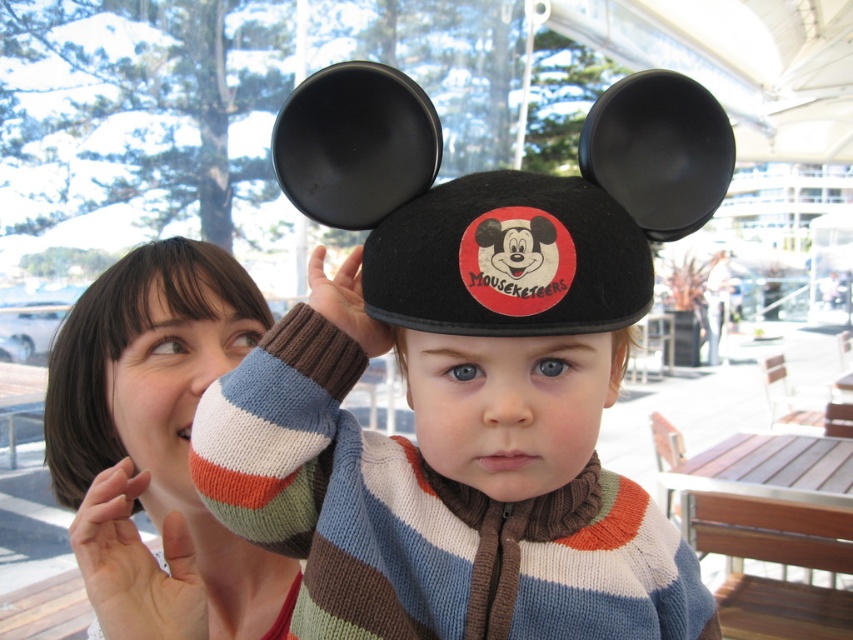
Between black felt hat at center and knit sweater at center, which one appears on the left side from the viewer's perspective?

Positioned to the left is knit sweater at center.

Is black felt hat at center in front of knit sweater at center?

That is True.

The image size is (853, 640). I want to click on black felt hat at center, so click(503, 200).

Measure the distance between fuzzy woolen hat at center and knit sweater at center.

9.29 inches

Does fuzzy woolen hat at center have a lesser width compared to knit sweater at center?

No, fuzzy woolen hat at center is not thinner than knit sweater at center.

What do you see at coordinates (457, 429) in the screenshot? The height and width of the screenshot is (640, 853). I see `fuzzy woolen hat at center` at bounding box center [457, 429].

The image size is (853, 640). What are the coordinates of `fuzzy woolen hat at center` in the screenshot? It's located at (457, 429).

Between point (579, 227) and point (622, 358), which one is positioned behind?

Point (622, 358)

Who is shorter, black felt hat at center or black felt ear at center?

black felt ear at center

Does point (544, 312) come closer to viewer compared to point (616, 378)?

Yes, point (544, 312) is in front of point (616, 378).

Find the location of a particular element. black felt hat at center is located at coordinates (503, 200).